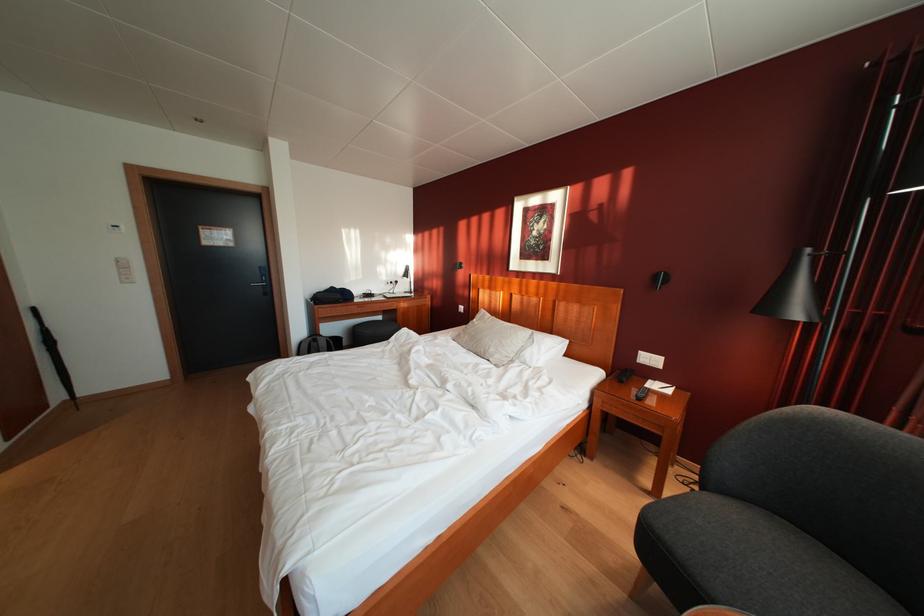
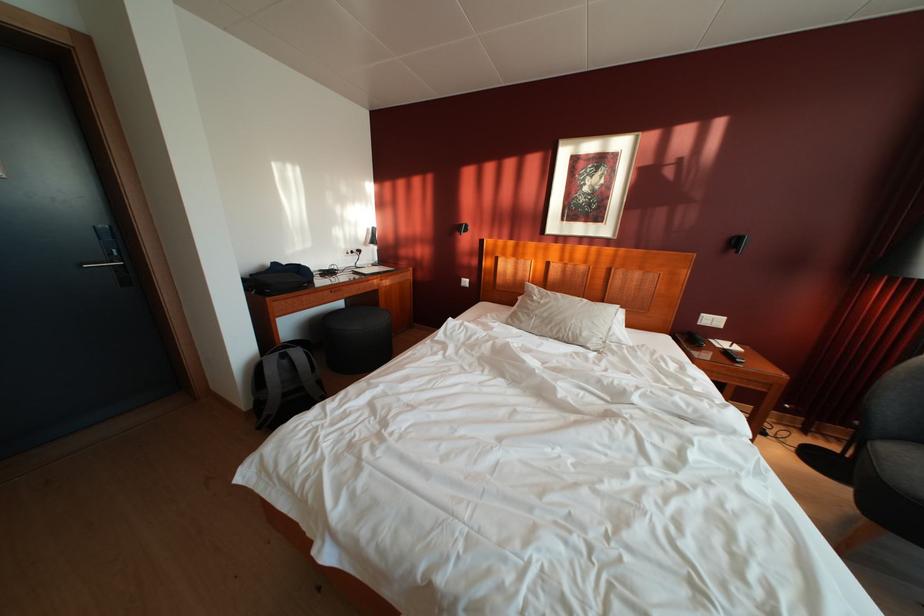
The point at (x=659, y=365) is marked in the first image. Where is the corresponding point in the second image?

(721, 326)